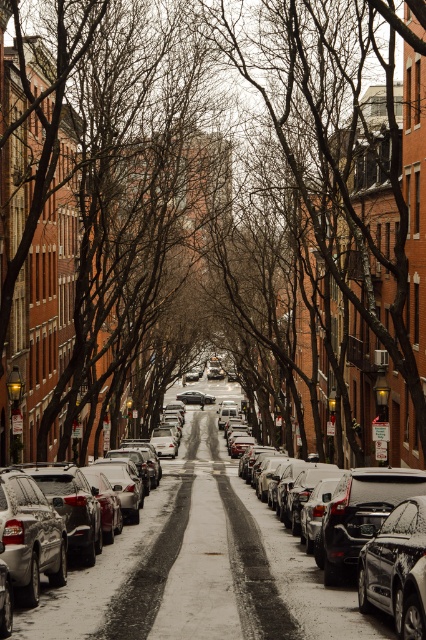
Question: Can you confirm if brown leafless tree at center is positioned above shiny black sedan at center?

Choices:
 (A) yes
 (B) no

Answer: (A)

Question: Which point is closer to the camera?

Choices:
 (A) shiny black sedan at center
 (B) brown leafless tree at center
 (C) silver metallic sedan at center

Answer: (A)

Question: Can you confirm if silver metallic sedan at center is positioned below shiny black sedan at center?

Choices:
 (A) no
 (B) yes

Answer: (B)

Question: Observing the image, what is the correct spatial positioning of brown leafless tree at center in reference to silver metallic sedan at center?

Choices:
 (A) right
 (B) left

Answer: (B)

Question: Which object is farther from the camera taking this photo?

Choices:
 (A) silver metallic sedan at center
 (B) shiny black sedan at center
 (C) brown leafless tree at center

Answer: (C)

Question: Based on their relative distances, which object is nearer to the brown leafless tree at center?

Choices:
 (A) shiny black sedan at center
 (B) silver metallic sedan at center

Answer: (B)